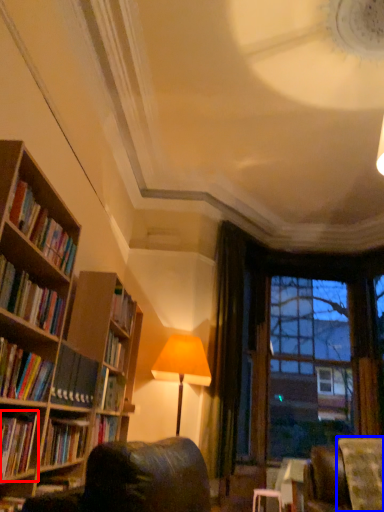
Question: Which point is closer to the camera, book (highlighted by a red box) or swivel chair (highlighted by a blue box)?

Choices:
 (A) book
 (B) swivel chair

Answer: (A)